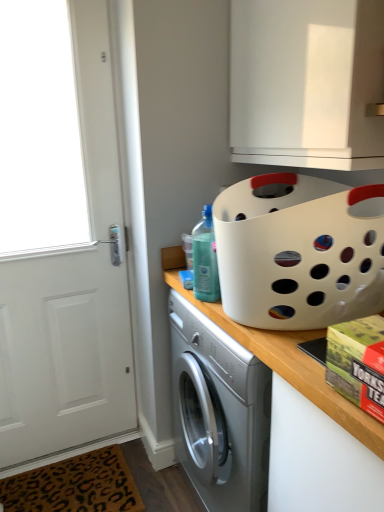
Image resolution: width=384 pixels, height=512 pixels. What do you see at coordinates (75, 485) in the screenshot? I see `brown leopard print mat at lower left` at bounding box center [75, 485].

This screenshot has width=384, height=512. Identify the location of brown leopard print mat at lower left. point(75,485).

Where is `screen door to the left of green matte box at lower right`? screen door to the left of green matte box at lower right is located at coordinates (60, 236).

Does white matte door at left come behind green matte box at lower right?

Yes, white matte door at left is further from the viewer.

From a real-world perspective, is white matte door at left physically above green matte box at lower right?

Actually, white matte door at left is physically below green matte box at lower right in the real world.

Is white matte door at left oriented towards green matte box at lower right?

No, white matte door at left is not facing towards green matte box at lower right.

What's the angular difference between white matte door at left and brown leopard print mat at lower left's facing directions?

The angle between the facing direction of white matte door at left and the facing direction of brown leopard print mat at lower left is 0.000356 degrees.

Is white matte door at left facing away from brown leopard print mat at lower left?

No.

From the image's perspective, would you say white matte door at left is shown under brown leopard print mat at lower left?

Actually, white matte door at left appears above brown leopard print mat at lower left in the image.

The width and height of the screenshot is (384, 512). Find the location of `screen door on the left of brown leopard print mat at lower left`. screen door on the left of brown leopard print mat at lower left is located at coordinates (60, 236).

Considering the relative sizes of white matte door at left and white matte countertop at center in the image provided, is white matte door at left wider than white matte countertop at center?

Incorrect, the width of white matte door at left does not surpass that of white matte countertop at center.

Between point (81, 173) and point (329, 411), which one is positioned behind?

Positioned behind is point (81, 173).

Does white matte door at left have a larger size compared to white matte countertop at center?

No.

Choose the correct answer: Is white matte door at left inside white matte countertop at center or outside it?

white matte door at left is located beyond the bounds of white matte countertop at center.

From the image's perspective, is green matte box at lower right located above or below white plastic basket at upper right?

green matte box at lower right is situated lower than white plastic basket at upper right in the image.

Considering the relative positions of green matte box at lower right and white plastic basket at upper right in the image provided, is green matte box at lower right to the left of white plastic basket at upper right from the viewer's perspective?

Yes.

Does green matte box at lower right have a smaller size compared to white plastic basket at upper right?

Yes.

From a real-world perspective, is white plastic basket at upper right over white matte door at left?

Correct, in the physical world, white plastic basket at upper right is higher than white matte door at left.

From the image's perspective, does white plastic basket at upper right appear lower than white matte door at left?

Yes, from the image's perspective, white plastic basket at upper right is below white matte door at left.

Considering the relative sizes of white plastic basket at upper right and white matte door at left in the image provided, is white plastic basket at upper right taller than white matte door at left?

In fact, white plastic basket at upper right may be shorter than white matte door at left.

Are white plastic basket at upper right and green matte box at lower right located far from each other?

That's not correct — white plastic basket at upper right is a little close to green matte box at lower right.

Considering the sizes of objects white plastic basket at upper right and green matte box at lower right in the image provided, who is bigger, white plastic basket at upper right or green matte box at lower right?

white plastic basket at upper right.

Consider the image. Is white plastic basket at upper right outside of green matte box at lower right?

Indeed, white plastic basket at upper right is completely outside green matte box at lower right.

Considering the relative sizes of white plastic basket at upper right and green matte box at lower right in the image provided, is white plastic basket at upper right wider than green matte box at lower right?

Indeed, white plastic basket at upper right has a greater width compared to green matte box at lower right.

Between brown leopard print mat at lower left and white plastic basket at upper right, which one has less height?

brown leopard print mat at lower left is shorter.

Is brown leopard print mat at lower left far away from white plastic basket at upper right?

Yes, brown leopard print mat at lower left and white plastic basket at upper right are located far from each other.

Could you tell me if brown leopard print mat at lower left is turned towards white plastic basket at upper right?

No, brown leopard print mat at lower left does not turn towards white plastic basket at upper right.

In order to click on box in front of the white matte door at left in this screenshot , I will do `click(358, 362)`.

Locate an element on the screen. Image resolution: width=384 pixels, height=512 pixels. screen door positioned vertically above the brown leopard print mat at lower left (from a real-world perspective) is located at coordinates (60, 236).

Based on their spatial positions, is white plastic basket at upper right or white matte door at left closer to translucent plastic bottle at upper center?

white plastic basket at upper right is closer to translucent plastic bottle at upper center.

Considering their positions, is white matte cabinet at upper center positioned further to translucent plastic bottle at upper center than brown leopard print mat at lower left?

Based on the image, brown leopard print mat at lower left appears to be further to translucent plastic bottle at upper center.

Which object lies further to the anchor point white plastic basket at upper right, brown leopard print mat at lower left or translucent plastic bottle at upper center?

brown leopard print mat at lower left lies further to white plastic basket at upper right than the other object.

When comparing their distances from white matte cabinet at upper center, does white plastic basket at upper right or green matte box at lower right seem further?

green matte box at lower right is further to white matte cabinet at upper center.

From the image, which object appears to be nearer to white plastic basket at upper right, white matte countertop at center or translucent plastic bottle at upper center?

Answer: white matte countertop at center is closer to white plastic basket at upper right.

Which object lies nearer to the anchor point translucent plastic bottle at upper center, white plastic basket at upper right or white matte cabinet at upper center?

The object closer to translucent plastic bottle at upper center is white plastic basket at upper right.

When comparing their distances from brown leopard print mat at lower left, does white matte countertop at center or white matte door at left seem closer?

The object closer to brown leopard print mat at lower left is white matte door at left.

From the image, which object appears to be farther from brown leopard print mat at lower left, white matte cabinet at upper center or translucent plastic bottle at upper center?

white matte cabinet at upper center is positioned further to the anchor brown leopard print mat at lower left.

Image resolution: width=384 pixels, height=512 pixels. Identify the location of basket between green matte box at lower right and translucent plastic bottle at upper center in the front-back direction. (299, 251).

Image resolution: width=384 pixels, height=512 pixels. In order to click on countertop between white matte door at left and white matte cabinet at upper center in the horizontal direction in this screenshot , I will do `click(295, 375)`.

Find the location of `bottle between white matte cabinet at upper center and white plastic basket at upper right in the vertical direction`. bottle between white matte cabinet at upper center and white plastic basket at upper right in the vertical direction is located at coordinates (205, 259).

Identify the location of box between translucent plastic bottle at upper center and brown leopard print mat at lower left in the up-down direction. (358, 362).